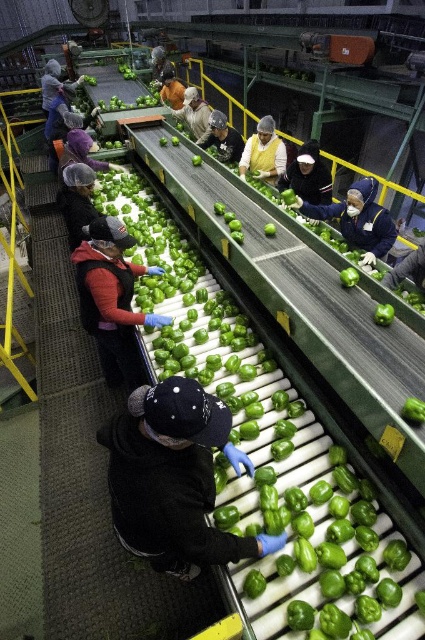
You are a quality inspector in the processing facility. You need to check the distance between the black fabric hat at center and the yellow fabric at center to ensure they are at least 8 feet apart for safety. Is the current distance compliant?

The black fabric hat at center is 7.94 feet from the yellow fabric at center. Since 7.94 feet is less than the required 8 feet, the current distance is not compliant with the safety requirement.

Looking at this image, you are a quality inspector standing in front of the conveyor belt. You notice two points on the conveyor belt labeled as point (76, 208) and point (252, 141). Which point is closer to your viewpoint?

Point (76, 208) is closer to the camera than point (252, 141), so the point labeled (76, 208) is closer to your viewpoint.